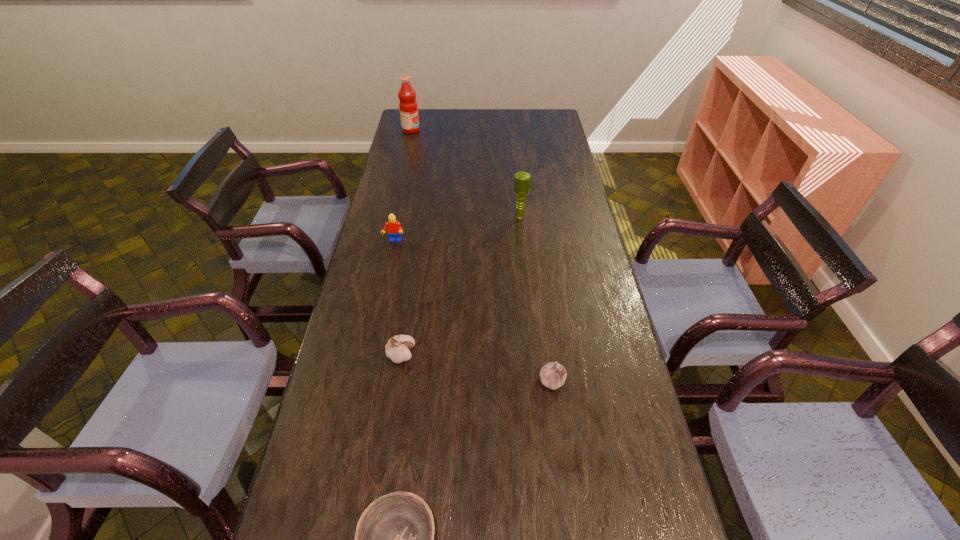
Where is `the farthest object`? This screenshot has height=540, width=960. the farthest object is located at coordinates (408, 107).

Where is `the tallest object`? The image size is (960, 540). the tallest object is located at coordinates [x=408, y=107].

At what (x,y) coordinates should I click in order to perform the action: click on the second tallest object. Please return your answer as a coordinate pair (x, y). The width and height of the screenshot is (960, 540). Looking at the image, I should click on (521, 179).

Find the location of a particular element. The image size is (960, 540). the second farthest object is located at coordinates (521, 179).

The image size is (960, 540). What are the coordinates of `Lego` in the screenshot? It's located at (394, 229).

Find the location of `the farther garlic`. the farther garlic is located at coordinates (397, 349).

Find the location of a particular element. the fourth farthest object is located at coordinates (397, 349).

Where is `the right garlic`? the right garlic is located at coordinates (553, 375).

At what (x,y) coordinates should I click in order to perform the action: click on the nearer garlic. Please return your answer as a coordinate pair (x, y). Looking at the image, I should click on (553, 375).

Identify the location of vacant space located 0.320m on the front label of the farthest object. This screenshot has height=540, width=960. (484, 130).